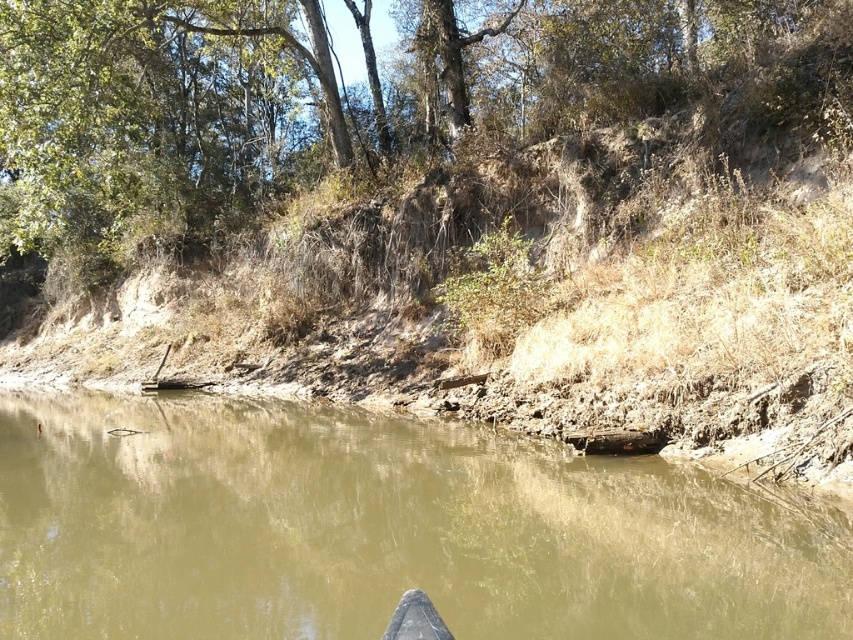
You are standing on the riverbank and want to take a photo of the brown muddy water at center. Where should you aim your camera to capture it?

The brown muddy water at center is located at the 2D coordinates point (376, 531), so aim your camera there to capture it.

You are an environmental scientist observing the riverside scene. You need to determine the relative positions of the brown muddy water at center and the green leafy tree at upper center. Which object is located to the right of the other?

The brown muddy water at center is positioned on the right side of green leafy tree at upper center, so the brown muddy water at center is to the right of the green leafy tree at upper center.